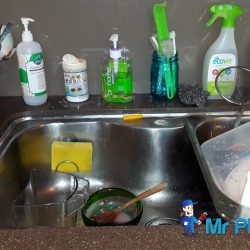
Identify the location of sink. (142, 161).